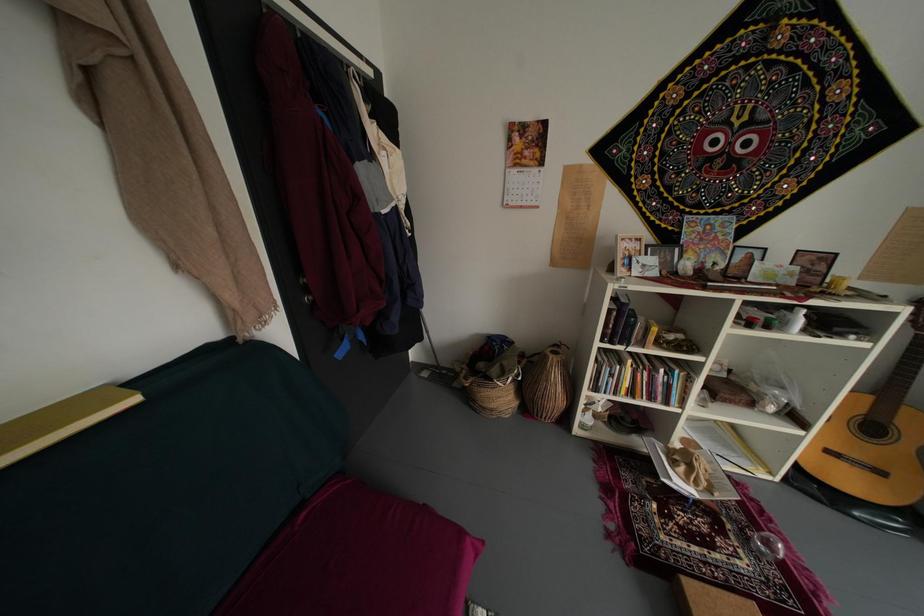
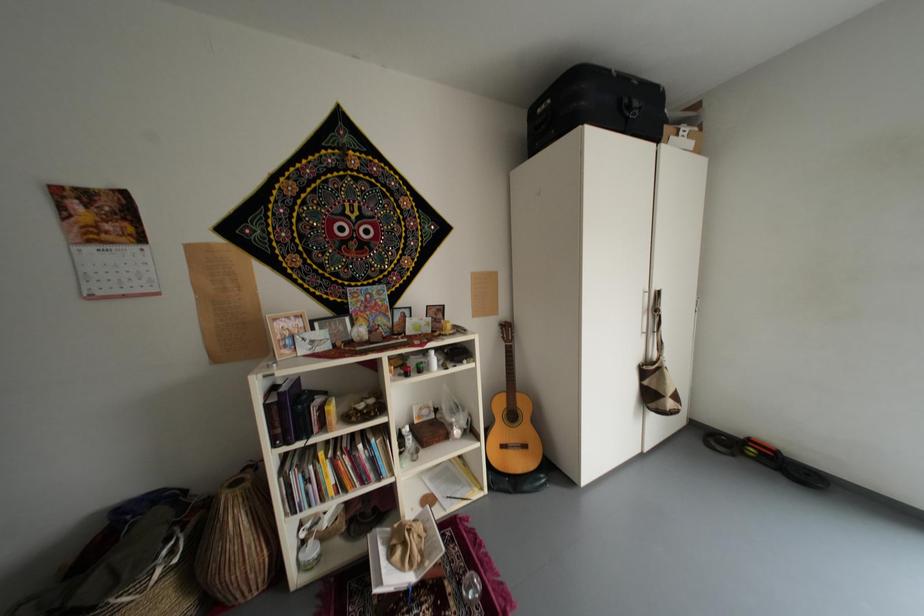
Question: The camera is either moving clockwise (left) or counter-clockwise (right) around the object. The first image is from the beginning of the video and the second image is from the end. Is the camera moving left or right when shooting the video?

Choices:
 (A) Left
 (B) Right

Answer: (A)